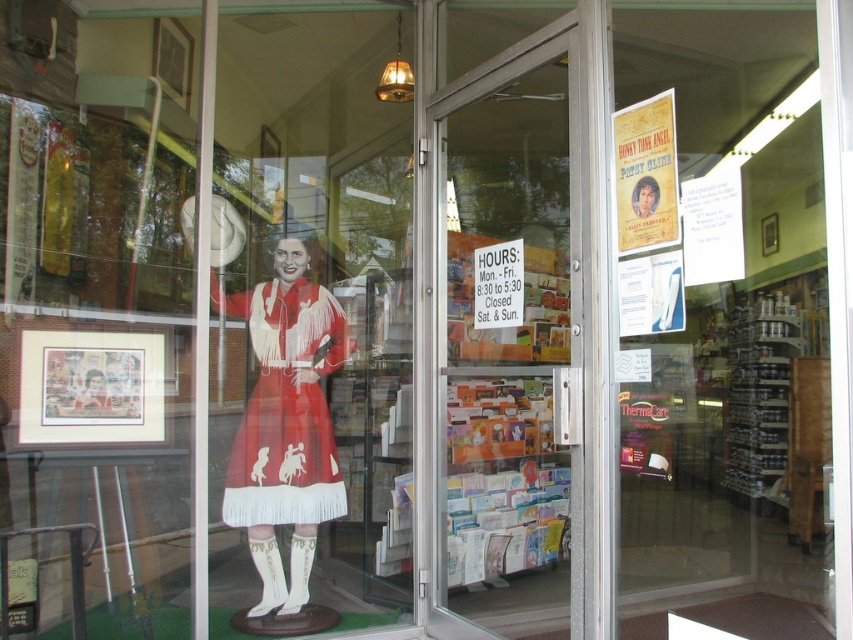
Who is more distant from viewer, (340, 513) or (519, 259)?

The point (340, 513) is more distant.

Measure the distance between white fringed dress at center and camera.

white fringed dress at center is 9.20 feet away from camera.

This screenshot has height=640, width=853. Describe the element at coordinates (286, 406) in the screenshot. I see `white fringed dress at center` at that location.

Locate an element on the screen. white fringed dress at center is located at coordinates click(x=286, y=406).

Who is positioned more to the left, matte paper poster at upper right or white paper sign at center?

white paper sign at center is more to the left.

Is point (614, 170) in front of point (483, 298)?

Yes, it is in front of point (483, 298).

The height and width of the screenshot is (640, 853). What are the coordinates of `matte paper poster at upper right` in the screenshot? It's located at (645, 173).

Is point (445, 464) positioned behind point (654, 193)?

That is True.

Can you confirm if transparent glass door at center is thinner than matte paper poster at upper right?

No.

Locate an element on the screen. transparent glass door at center is located at coordinates (505, 352).